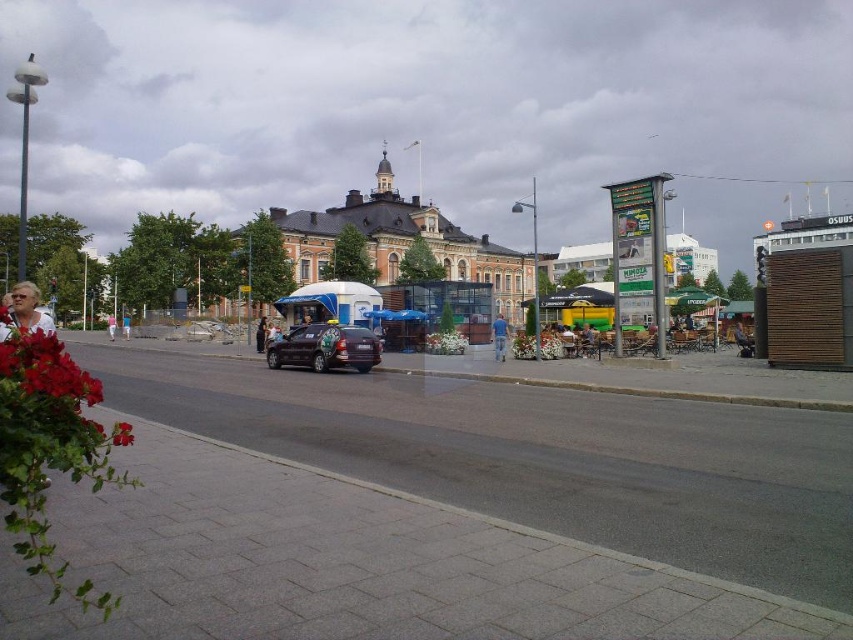
Can you confirm if blue jeans at center is positioned to the right of pink fabric person at lower left?

Yes, blue jeans at center is to the right of pink fabric person at lower left.

Is point (498, 360) in front of point (114, 330)?

Yes, it is.

What do you see at coordinates (498, 337) in the screenshot? I see `blue jeans at center` at bounding box center [498, 337].

At what (x,y) coordinates should I click in order to perform the action: click on blue jeans at center. Please return your answer as a coordinate pair (x, y). Looking at the image, I should click on (498, 337).

In the scene shown: Does yellow fabric umbrella at center have a smaller size compared to dark brown leather jacket at center?

Yes.

Looking at this image, does yellow fabric umbrella at center have a greater height compared to dark brown leather jacket at center?

Yes, yellow fabric umbrella at center is taller than dark brown leather jacket at center.

Does point (593, 307) come behind point (259, 337)?

Yes, it is.

The height and width of the screenshot is (640, 853). Identify the location of yellow fabric umbrella at center. (578, 307).

Does matte white shirt at lower left have a smaller size compared to pink fabric person at lower left?

Yes, matte white shirt at lower left is smaller than pink fabric person at lower left.

Which is behind, point (22, 294) or point (111, 321)?

Positioned behind is point (111, 321).

This screenshot has width=853, height=640. I want to click on matte white shirt at lower left, so click(25, 310).

The height and width of the screenshot is (640, 853). What are the coordinates of `matte white shirt at lower left` in the screenshot? It's located at (25, 310).